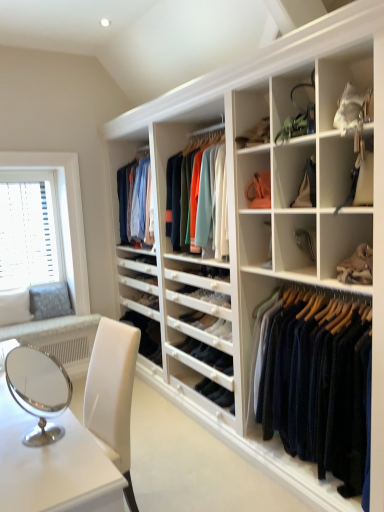
The width and height of the screenshot is (384, 512). What do you see at coordinates (291, 243) in the screenshot?
I see `white matte shelf at center, marked as the second shelf in a bottom-to-top arrangement` at bounding box center [291, 243].

The width and height of the screenshot is (384, 512). Find the location of `navy wool sweater at center`. navy wool sweater at center is located at coordinates (318, 383).

Where is `matte black purse at upper right, the 2th shelf when ordered from top to bottom`? matte black purse at upper right, the 2th shelf when ordered from top to bottom is located at coordinates (346, 172).

What do you see at coordinates (341, 239) in the screenshot?
I see `leather handbag at center right, the first shelf positioned from the bottom` at bounding box center [341, 239].

I want to click on white plastic blinds at left, so click(30, 229).

Who is bigger, white plastic blinds at left or matte black purse at upper right, the 2th shelf when ordered from top to bottom?

white plastic blinds at left is bigger.

Is white plastic blinds at left positioned behind matte black purse at upper right, the 3th shelf positioned from the bottom?

Yes, it is behind matte black purse at upper right, the 3th shelf positioned from the bottom.

The width and height of the screenshot is (384, 512). In order to click on shelf that is the 4th one when counting forward from the white plastic blinds at left in this screenshot , I will do `click(346, 172)`.

From a real-world perspective, between white plastic blinds at left and matte black purse at upper right, the 2th shelf when ordered from top to bottom, who is vertically lower?

white plastic blinds at left is physically lower.

Is matte green handbag at upper right, the 1th shelf from the top, positioned behind white matte shelf at center, placed as the third shelf when sorted from top to bottom?

No, matte green handbag at upper right, the 1th shelf from the top, is closer to the camera.

Is white matte shelf at center, marked as the second shelf in a bottom-to-top arrangement, a part of matte green handbag at upper right, which appears as the 4th shelf when ordered from the bottom?

Actually, white matte shelf at center, marked as the second shelf in a bottom-to-top arrangement, is outside matte green handbag at upper right, which appears as the 4th shelf when ordered from the bottom.

Is matte green handbag at upper right, the 1th shelf from the top, far away from white matte shelf at center, marked as the second shelf in a bottom-to-top arrangement?

matte green handbag at upper right, the 1th shelf from the top, is near white matte shelf at center, marked as the second shelf in a bottom-to-top arrangement, not far away.

Is matte green handbag at upper right, which appears as the 4th shelf when ordered from the bottom, shorter than white matte shelf at center, placed as the third shelf when sorted from top to bottom?

Indeed, matte green handbag at upper right, which appears as the 4th shelf when ordered from the bottom, has a lesser height compared to white matte shelf at center, placed as the third shelf when sorted from top to bottom.

Is leather handbag at center right, which ranks as the fourth shelf in top-to-bottom order, placed right next to matte black purse at upper right, the 3th shelf positioned from the bottom?

leather handbag at center right, which ranks as the fourth shelf in top-to-bottom order, and matte black purse at upper right, the 3th shelf positioned from the bottom, are not in contact.

Between leather handbag at center right, the first shelf positioned from the bottom, and matte black purse at upper right, the 3th shelf positioned from the bottom, which one has smaller size?

With smaller size is leather handbag at center right, the first shelf positioned from the bottom.

Which is behind, leather handbag at center right, the first shelf positioned from the bottom, or matte black purse at upper right, the 2th shelf when ordered from top to bottom?

leather handbag at center right, the first shelf positioned from the bottom, is further away from the camera.

Which of these two, leather handbag at center right, which ranks as the fourth shelf in top-to-bottom order, or matte black purse at upper right, the 3th shelf positioned from the bottom, stands shorter?

leather handbag at center right, which ranks as the fourth shelf in top-to-bottom order, is shorter.

How far apart are white plastic blinds at left and white matte shelf at center, placed as the third shelf when sorted from top to bottom?

The distance of white plastic blinds at left from white matte shelf at center, placed as the third shelf when sorted from top to bottom, is 8.60 feet.

Does white plastic blinds at left come behind white matte shelf at center, placed as the third shelf when sorted from top to bottom?

Yes, white plastic blinds at left is further from the viewer.

Does white plastic blinds at left turn towards white matte shelf at center, marked as the second shelf in a bottom-to-top arrangement?

Yes, white plastic blinds at left is turned towards white matte shelf at center, marked as the second shelf in a bottom-to-top arrangement.

Based on the photo, can we say white plastic blinds at left lies outside white matte shelf at center, placed as the third shelf when sorted from top to bottom?

Yes, white plastic blinds at left is outside of white matte shelf at center, placed as the third shelf when sorted from top to bottom.

Considering the relative sizes of white plastic blinds at left and matte green handbag at upper right, which appears as the 4th shelf when ordered from the bottom, in the image provided, is white plastic blinds at left smaller than matte green handbag at upper right, which appears as the 4th shelf when ordered from the bottom,?

No.

Is white plastic blinds at left far from matte green handbag at upper right, which appears as the 4th shelf when ordered from the bottom?

Yes, white plastic blinds at left is far from matte green handbag at upper right, which appears as the 4th shelf when ordered from the bottom.

Considering the sizes of white plastic blinds at left and matte green handbag at upper right, the 1th shelf from the top, in the image, is white plastic blinds at left wider or thinner than matte green handbag at upper right, the 1th shelf from the top,?

In the image, white plastic blinds at left appears to be more narrow than matte green handbag at upper right, the 1th shelf from the top.

In terms of height, does leather handbag at center right, which ranks as the fourth shelf in top-to-bottom order, look taller or shorter compared to white plastic blinds at left?

In the image, leather handbag at center right, which ranks as the fourth shelf in top-to-bottom order, appears to be shorter than white plastic blinds at left.

Considering the relative sizes of leather handbag at center right, which ranks as the fourth shelf in top-to-bottom order, and white plastic blinds at left in the image provided, is leather handbag at center right, which ranks as the fourth shelf in top-to-bottom order, wider than white plastic blinds at left?

Yes, leather handbag at center right, which ranks as the fourth shelf in top-to-bottom order, is wider than white plastic blinds at left.

Between leather handbag at center right, which ranks as the fourth shelf in top-to-bottom order, and white plastic blinds at left, which one appears on the right side from the viewer's perspective?

From the viewer's perspective, leather handbag at center right, which ranks as the fourth shelf in top-to-bottom order, appears more on the right side.

This screenshot has height=512, width=384. I want to click on window screen to the left of leather handbag at center right, which ranks as the fourth shelf in top-to-bottom order, so click(x=30, y=229).

Can you confirm if matte black purse at upper right, the 3th shelf positioned from the bottom, is smaller than white plastic blinds at left?

Indeed, matte black purse at upper right, the 3th shelf positioned from the bottom, has a smaller size compared to white plastic blinds at left.

Considering the positions of objects matte black purse at upper right, the 3th shelf positioned from the bottom, and white plastic blinds at left in the image provided, who is in front, matte black purse at upper right, the 3th shelf positioned from the bottom, or white plastic blinds at left?

matte black purse at upper right, the 3th shelf positioned from the bottom.

Based on the photo, from a real-world perspective, which object stands above the other?

matte black purse at upper right, the 2th shelf when ordered from top to bottom, from a real-world perspective.

From the image's perspective, is matte black purse at upper right, the 3th shelf positioned from the bottom, over white plastic blinds at left?

Yes.

This screenshot has width=384, height=512. I want to click on window screen lying behind the matte black purse at upper right, the 2th shelf when ordered from top to bottom, so click(x=30, y=229).

Find the location of `shelf that is the 2nd object directly below the matte green handbag at upper right, which appears as the 4th shelf when ordered from the bottom (from a real-world perspective)`. shelf that is the 2nd object directly below the matte green handbag at upper right, which appears as the 4th shelf when ordered from the bottom (from a real-world perspective) is located at coordinates (291, 243).

When comparing their distances from white plastic blinds at left, does leather handbag at center right, the first shelf positioned from the bottom, or white matte shelf at center, marked as the second shelf in a bottom-to-top arrangement, seem closer?

Based on the image, white matte shelf at center, marked as the second shelf in a bottom-to-top arrangement, appears to be nearer to white plastic blinds at left.

Which object lies nearer to the anchor point matte black purse at upper right, the 2th shelf when ordered from top to bottom, white plastic blinds at left or white matte shelf at center, marked as the second shelf in a bottom-to-top arrangement?

white matte shelf at center, marked as the second shelf in a bottom-to-top arrangement, is positioned closer to the anchor matte black purse at upper right, the 2th shelf when ordered from top to bottom.

Which object lies nearer to the anchor point leather handbag at center right, which ranks as the fourth shelf in top-to-bottom order, matte green handbag at upper right, the 1th shelf from the top, or matte black purse at upper right, the 3th shelf positioned from the bottom?

matte black purse at upper right, the 3th shelf positioned from the bottom, is closer to leather handbag at center right, which ranks as the fourth shelf in top-to-bottom order.

Based on the photo, considering their positions, is navy wool sweater at center positioned further to white plastic blinds at left than white matte shelf at center, placed as the third shelf when sorted from top to bottom?

navy wool sweater at center lies further to white plastic blinds at left than the other object.

Based on their spatial positions, is leather handbag at center right, which ranks as the fourth shelf in top-to-bottom order, or navy wool sweater at center further from white matte shelf at center, marked as the second shelf in a bottom-to-top arrangement?

navy wool sweater at center is positioned further to the anchor white matte shelf at center, marked as the second shelf in a bottom-to-top arrangement.

When comparing their distances from matte black purse at upper right, the 3th shelf positioned from the bottom, does white plastic blinds at left or leather handbag at center right, which ranks as the fourth shelf in top-to-bottom order, seem further?

Among the two, white plastic blinds at left is located further to matte black purse at upper right, the 3th shelf positioned from the bottom.

Considering their positions, is matte black purse at upper right, the 3th shelf positioned from the bottom, positioned closer to navy wool sweater at center than matte green handbag at upper right, the 1th shelf from the top?

Among the two, matte black purse at upper right, the 3th shelf positioned from the bottom, is located nearer to navy wool sweater at center.

Based on their spatial positions, is leather handbag at center right, which ranks as the fourth shelf in top-to-bottom order, or matte green handbag at upper right, the 1th shelf from the top, closer to matte black purse at upper right, the 3th shelf positioned from the bottom?

Based on the image, leather handbag at center right, which ranks as the fourth shelf in top-to-bottom order, appears to be nearer to matte black purse at upper right, the 3th shelf positioned from the bottom.

Find the location of a particular element. clothing situated between white plastic blinds at left and matte black purse at upper right, the 3th shelf positioned from the bottom, from left to right is located at coordinates (318, 383).

This screenshot has width=384, height=512. Identify the location of clothing between white plastic blinds at left and leather handbag at center right, the first shelf positioned from the bottom, in the horizontal direction. (318, 383).

Where is `shelf between matte green handbag at upper right, which appears as the 4th shelf when ordered from the bottom, and white matte shelf at center, marked as the second shelf in a bottom-to-top arrangement, from top to bottom`? This screenshot has height=512, width=384. shelf between matte green handbag at upper right, which appears as the 4th shelf when ordered from the bottom, and white matte shelf at center, marked as the second shelf in a bottom-to-top arrangement, from top to bottom is located at coordinates (346, 172).

Image resolution: width=384 pixels, height=512 pixels. Identify the location of shelf between white matte shelf at center, placed as the third shelf when sorted from top to bottom, and navy wool sweater at center from top to bottom. coord(341,239).